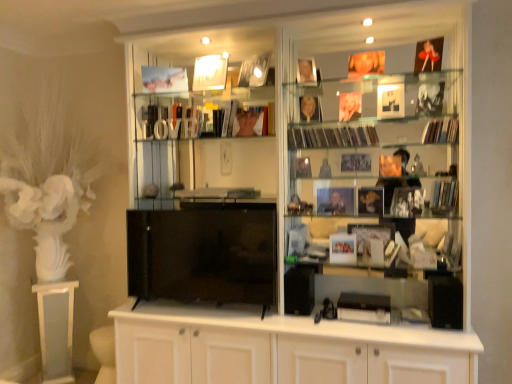
Question: From a real-world perspective, is black glossy tv at center physically below matte gold photo frame at upper center, the 2th book in the bottom-to-top sequence?

Choices:
 (A) no
 (B) yes

Answer: (B)

Question: Is black glossy tv at center directly adjacent to matte gold photo frame at upper center, arranged as the second book when viewed from the front?

Choices:
 (A) no
 (B) yes

Answer: (A)

Question: Does black glossy tv at center have a smaller size compared to matte gold photo frame at upper center, the 2th book in the bottom-to-top sequence?

Choices:
 (A) yes
 (B) no

Answer: (B)

Question: Can you confirm if black glossy tv at center is taller than matte gold photo frame at upper center, the second book viewed from the right?

Choices:
 (A) no
 (B) yes

Answer: (B)

Question: From the image's perspective, is black glossy tv at center above matte gold photo frame at upper center, arranged as the first book when viewed from the left?

Choices:
 (A) no
 (B) yes

Answer: (A)

Question: From a real-world perspective, is shiny plastic magazines at center right, which is counted as the fourth magazine, starting from the bottom, physically located above or below white glossy pedestal at left?

Choices:
 (A) above
 (B) below

Answer: (A)

Question: Looking at the image, does shiny plastic magazines at center right, arranged as the 2th magazine when viewed from the top, seem bigger or smaller compared to white glossy pedestal at left?

Choices:
 (A) small
 (B) big

Answer: (A)

Question: Considering their positions, is shiny plastic magazines at center right, which is counted as the fourth magazine, starting from the bottom, located in front of or behind white glossy pedestal at left?

Choices:
 (A) front
 (B) behind

Answer: (A)

Question: From the image's perspective, is shiny plastic magazines at center right, arranged as the 2th magazine when viewed from the top, above or below white glossy pedestal at left?

Choices:
 (A) below
 (B) above

Answer: (B)

Question: Considering their positions, is black glossy tv at center located in front of or behind shiny plastic magazines at center right, arranged as the 2th magazine when viewed from the top?

Choices:
 (A) front
 (B) behind

Answer: (A)

Question: In the image, is black glossy tv at center on the left side or the right side of shiny plastic magazines at center right, which is counted as the fourth magazine, starting from the bottom?

Choices:
 (A) right
 (B) left

Answer: (B)

Question: In terms of width, does black glossy tv at center look wider or thinner when compared to shiny plastic magazines at center right, which is counted as the fourth magazine, starting from the bottom?

Choices:
 (A) thin
 (B) wide

Answer: (A)

Question: Is black glossy tv at center bigger or smaller than shiny plastic magazines at center right, arranged as the 2th magazine when viewed from the top?

Choices:
 (A) big
 (B) small

Answer: (A)

Question: From a real-world perspective, relative to matte paper magazine at upper right, which is the 1th magazine in top-to-bottom order, is shiny plastic magazines at center right, arranged as the 2th magazine when viewed from the top, vertically above or below?

Choices:
 (A) above
 (B) below

Answer: (A)

Question: Is point (344, 137) positioned closer to the camera than point (424, 130)?

Choices:
 (A) farther
 (B) closer

Answer: (A)